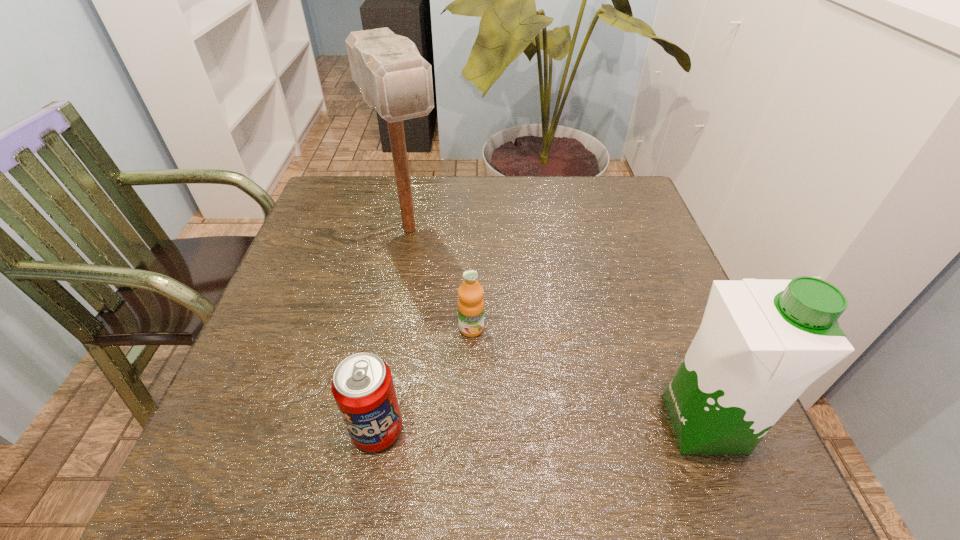
This screenshot has height=540, width=960. What are the coordinates of `free location at the near edge` in the screenshot? It's located at tap(464, 397).

At what (x,y) coordinates should I click in order to perform the action: click on vacant region at the left edge of the desktop. Please return your answer as a coordinate pair (x, y). This screenshot has width=960, height=540. Looking at the image, I should click on (338, 268).

This screenshot has width=960, height=540. Identify the location of vacant region at the right edge of the desktop. (654, 288).

You are a GUI agent. You are given a task and a screenshot of the screen. Output one action in this format:
    pyautogui.click(x=<x>, y=<y>)
    Task: Click on the vacant space at the far left corner of the desktop
    The image size is (960, 540).
    Given the screenshot: What is the action you would take?
    pyautogui.click(x=336, y=202)

In the image, there is a desktop. Where is `free region at the far right corner`? Image resolution: width=960 pixels, height=540 pixels. free region at the far right corner is located at coordinates (613, 181).

This screenshot has height=540, width=960. I want to click on free space between the farthest object and the orange juice, so click(x=441, y=279).

The height and width of the screenshot is (540, 960). I want to click on free spot between the soda can and the mallet, so click(394, 329).

You are a GUI agent. You are given a task and a screenshot of the screen. Output one action in this format:
    pyautogui.click(x=<x>, y=<y>)
    Task: Click on the free space between the rightmost object and the mallet
    This screenshot has width=960, height=540.
    Given the screenshot: What is the action you would take?
    pyautogui.click(x=556, y=326)

I want to click on unoccupied position between the rightmost object and the farthest object, so click(x=556, y=326).

Find the location of a particular element. The height and width of the screenshot is (540, 960). vacant region between the orange juice and the farthest object is located at coordinates (441, 279).